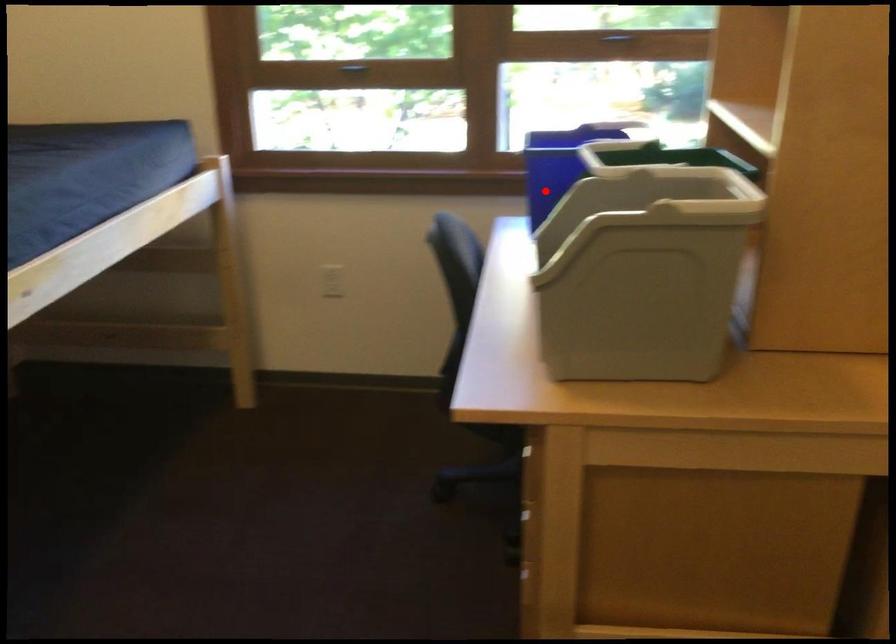
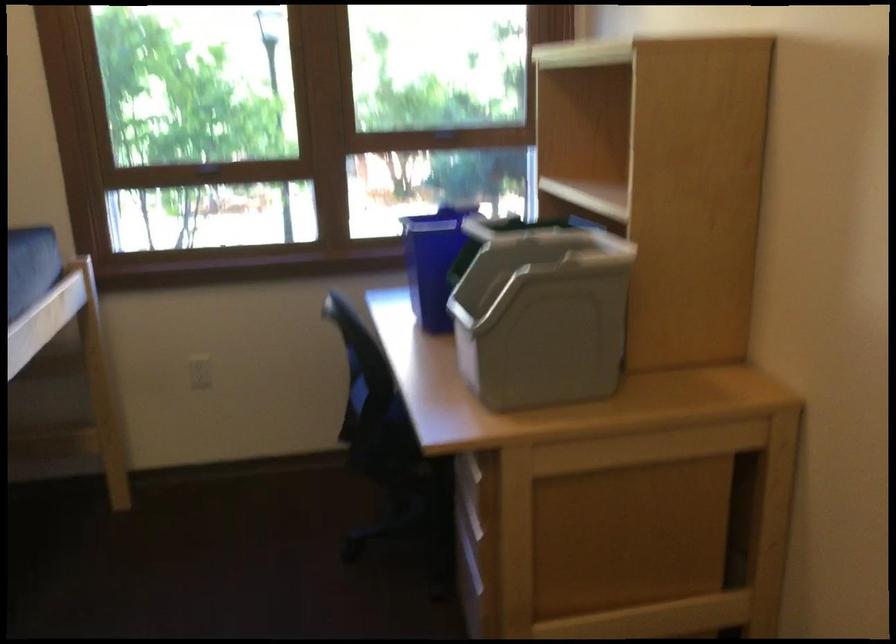
Question: I am providing you with two images of the same scene from different viewpoints. Given a red point in image1, look at the same physical point in image2. Is it:

Choices:
 (A) Closer to the viewpoint
 (B) Farther from the viewpoint

Answer: (B)